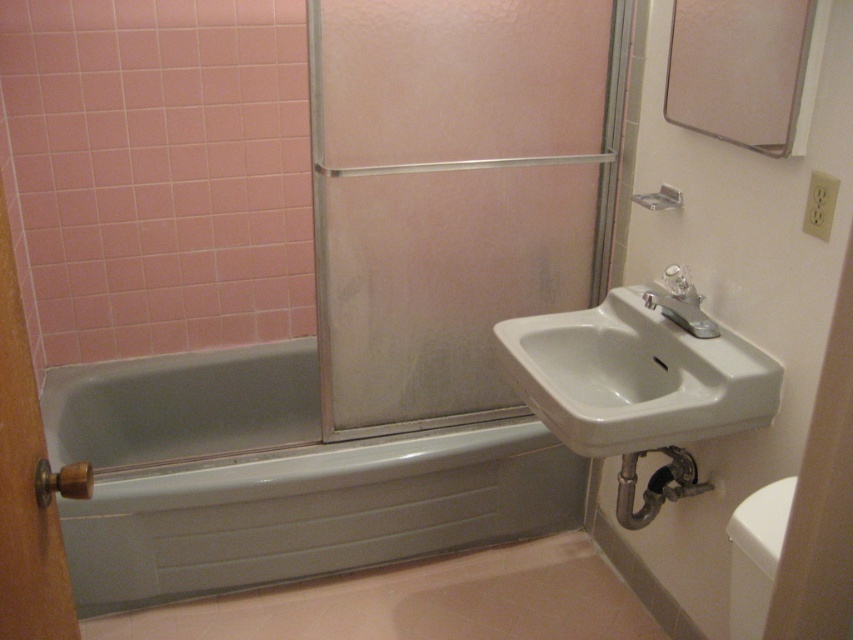
Does white glossy bathtub at lower left appear on the left side of white glossy toilet bowl at lower right?

Indeed, white glossy bathtub at lower left is positioned on the left side of white glossy toilet bowl at lower right.

What do you see at coordinates (274, 477) in the screenshot? I see `white glossy bathtub at lower left` at bounding box center [274, 477].

Where is `white glossy bathtub at lower left`? Image resolution: width=853 pixels, height=640 pixels. white glossy bathtub at lower left is located at coordinates (274, 477).

Consider the image. Does white ceramic sink at right appear on the left side of wooden knob at left?

No, white ceramic sink at right is not to the left of wooden knob at left.

Between point (619, 417) and point (10, 628), which one is positioned behind?

Positioned behind is point (619, 417).

I want to click on white ceramic sink at right, so click(637, 372).

Can you confirm if white glossy bathtub at lower left is positioned to the right of satin nickel faucet at right?

In fact, white glossy bathtub at lower left is to the left of satin nickel faucet at right.

Who is taller, white glossy bathtub at lower left or satin nickel faucet at right?

white glossy bathtub at lower left

Does point (560, 458) come closer to viewer compared to point (709, 323)?

No, it is behind (709, 323).

Identify the location of white glossy bathtub at lower left. The height and width of the screenshot is (640, 853). (274, 477).